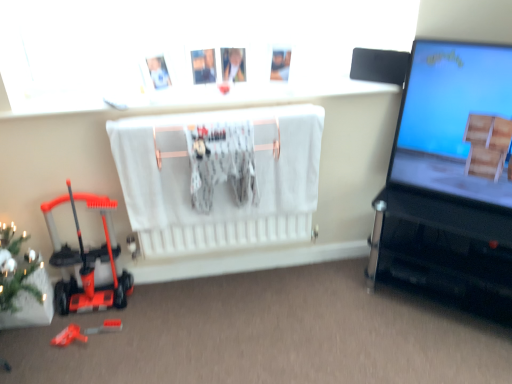
What do you see at coordinates (451, 117) in the screenshot? I see `matte blue screen at right` at bounding box center [451, 117].

Measure the distance between point (110,329) and camera.

Point (110,329) and camera are 6.45 feet apart.

This screenshot has height=384, width=512. What are the coordinates of `orange plastic toy at lower left, positioned as the 3th toy in bottom-to-top order` in the screenshot? It's located at (88, 261).

Considering the sizes of objects orange plastic toy at lower left, positioned as the 3th toy in bottom-to-top order, and matte blue screen at right in the image provided, who is taller, orange plastic toy at lower left, positioned as the 3th toy in bottom-to-top order, or matte blue screen at right?

Standing taller between the two is matte blue screen at right.

There is a matte blue screen at right. Identify the location of the 1st toy below it (from a real-world perspective). (88, 261).

Is orange plastic toy at lower left, positioned as the 3th toy in bottom-to-top order, smaller than matte blue screen at right?

Indeed, orange plastic toy at lower left, positioned as the 3th toy in bottom-to-top order, has a smaller size compared to matte blue screen at right.

In the scene shown: From a real-world perspective, who is located higher, orange plastic toy at lower left, positioned as the 3th toy in bottom-to-top order, or matte blue screen at right?

matte blue screen at right is physically above.

From the picture: From a real-world perspective, is rubberized orange toy at lower left, which is counted as the 2th toy, starting from the top, physically located above or below orange plastic toy at lower left, positioned as the 3th toy in bottom-to-top order?

In terms of real-world spatial position, rubberized orange toy at lower left, which is counted as the 2th toy, starting from the top, is below orange plastic toy at lower left, positioned as the 3th toy in bottom-to-top order.

Is rubberized orange toy at lower left, which is counted as the second toy, starting from the bottom, looking in the opposite direction of orange plastic toy at lower left, positioned as the 3th toy in bottom-to-top order?

Absolutely, rubberized orange toy at lower left, which is counted as the second toy, starting from the bottom, is directed away from orange plastic toy at lower left, positioned as the 3th toy in bottom-to-top order.

Considering the relative sizes of rubberized orange toy at lower left, which is counted as the second toy, starting from the bottom, and orange plastic toy at lower left, the 1th toy when ordered from top to bottom, in the image provided, is rubberized orange toy at lower left, which is counted as the second toy, starting from the bottom, taller than orange plastic toy at lower left, the 1th toy when ordered from top to bottom,?

No.

What's the angular difference between rubberized orange toy at lower left, which is counted as the second toy, starting from the bottom, and orange plastic toy at lower left, positioned as the 3th toy in bottom-to-top order,'s facing directions?

They differ by 7.6e-05 degrees in their facing directions.

From a real-world perspective, does green matte christmas tree at lower left stand above black glossy tv stand at right?

No, from a real-world perspective, green matte christmas tree at lower left is not on top of black glossy tv stand at right.

Considering the positions of objects green matte christmas tree at lower left and black glossy tv stand at right in the image provided, who is more to the right, green matte christmas tree at lower left or black glossy tv stand at right?

From the viewer's perspective, black glossy tv stand at right appears more on the right side.

In terms of height, does green matte christmas tree at lower left look taller or shorter compared to black glossy tv stand at right?

green matte christmas tree at lower left is shorter than black glossy tv stand at right.

Is point (15, 285) closer or farther from the camera than point (443, 219)?

Point (15, 285).

What's the angular difference between black glossy tv stand at right and rubberized orange toy at lower left, the first toy from the bottom,'s facing directions?

The angle between the facing direction of black glossy tv stand at right and the facing direction of rubberized orange toy at lower left, the first toy from the bottom, is 42.8 degrees.

Between black glossy tv stand at right and rubberized orange toy at lower left, the first toy from the bottom, which one has less height?

rubberized orange toy at lower left, the first toy from the bottom.

Between black glossy tv stand at right and rubberized orange toy at lower left, arranged as the 3th toy when viewed from the top, which one has larger width?

black glossy tv stand at right.

From the image's perspective, is black glossy tv stand at right below rubberized orange toy at lower left, which is counted as the 2th toy, starting from the top?

No, from the image's perspective, black glossy tv stand at right is not below rubberized orange toy at lower left, which is counted as the 2th toy, starting from the top.

Considering the relative sizes of black glossy tv stand at right and rubberized orange toy at lower left, which is counted as the 2th toy, starting from the top, in the image provided, is black glossy tv stand at right shorter than rubberized orange toy at lower left, which is counted as the 2th toy, starting from the top,?

No.

Looking at their sizes, would you say black glossy tv stand at right is wider or thinner than rubberized orange toy at lower left, which is counted as the 2th toy, starting from the top?

In the image, black glossy tv stand at right appears to be wider than rubberized orange toy at lower left, which is counted as the 2th toy, starting from the top.

Would you say black glossy tv stand at right contains rubberized orange toy at lower left, which is counted as the second toy, starting from the bottom?

Actually, rubberized orange toy at lower left, which is counted as the second toy, starting from the bottom, is outside black glossy tv stand at right.

How many degrees apart are the facing directions of orange plastic toy at lower left, the 1th toy when ordered from top to bottom, and black glossy tv stand at right?

The angle between the facing direction of orange plastic toy at lower left, the 1th toy when ordered from top to bottom, and the facing direction of black glossy tv stand at right is 42.8 degrees.

Which object is thinner, orange plastic toy at lower left, the 1th toy when ordered from top to bottom, or black glossy tv stand at right?

orange plastic toy at lower left, the 1th toy when ordered from top to bottom, is thinner.

Is orange plastic toy at lower left, the 1th toy when ordered from top to bottom, facing away from black glossy tv stand at right?

No, black glossy tv stand at right is not at the back of orange plastic toy at lower left, the 1th toy when ordered from top to bottom.

Is orange plastic toy at lower left, positioned as the 3th toy in bottom-to-top order, bigger than black glossy tv stand at right?

Actually, orange plastic toy at lower left, positioned as the 3th toy in bottom-to-top order, might be smaller than black glossy tv stand at right.

Looking at this image, considering the sizes of objects rubberized orange toy at lower left, arranged as the 3th toy when viewed from the top, and black glossy tv stand at right in the image provided, who is wider, rubberized orange toy at lower left, arranged as the 3th toy when viewed from the top, or black glossy tv stand at right?

black glossy tv stand at right.

Is the position of rubberized orange toy at lower left, arranged as the 3th toy when viewed from the top, more distant than that of black glossy tv stand at right?

Yes, rubberized orange toy at lower left, arranged as the 3th toy when viewed from the top, is behind black glossy tv stand at right.

From a real-world perspective, is rubberized orange toy at lower left, arranged as the 3th toy when viewed from the top, below black glossy tv stand at right?

Yes, from a real-world perspective, rubberized orange toy at lower left, arranged as the 3th toy when viewed from the top, is under black glossy tv stand at right.

From the image's perspective, which is above, rubberized orange toy at lower left, arranged as the 3th toy when viewed from the top, or black glossy tv stand at right?

black glossy tv stand at right, from the image's perspective.

The image size is (512, 384). I want to click on toy that is the 1st object directly below the matte blue screen at right (from a real-world perspective), so click(88, 261).

Which toy is the 1st one when counting from the left side of the rubberized orange toy at lower left, which is counted as the 2th toy, starting from the top? Please provide its 2D coordinates.

[(88, 261)]

From the image, which object appears to be farther from rubberized orange toy at lower left, which is counted as the 2th toy, starting from the top, orange plastic toy at lower left, positioned as the 3th toy in bottom-to-top order, or green matte christmas tree at lower left?

The object further to rubberized orange toy at lower left, which is counted as the 2th toy, starting from the top, is green matte christmas tree at lower left.

From the image, which object appears to be farther from orange plastic toy at lower left, positioned as the 3th toy in bottom-to-top order, green matte christmas tree at lower left or rubberized orange toy at lower left, the first toy from the bottom?

rubberized orange toy at lower left, the first toy from the bottom, is positioned further to the anchor orange plastic toy at lower left, positioned as the 3th toy in bottom-to-top order.

When comparing their distances from rubberized orange toy at lower left, which is counted as the second toy, starting from the bottom, does green matte christmas tree at lower left or orange plastic toy at lower left, the 1th toy when ordered from top to bottom, seem further?

green matte christmas tree at lower left is positioned further to the anchor rubberized orange toy at lower left, which is counted as the second toy, starting from the bottom.

Consider the image. Estimate the real-world distances between objects in this image. Which object is closer to orange plastic toy at lower left, positioned as the 3th toy in bottom-to-top order, black glossy tv stand at right or matte blue screen at right?

Based on the image, black glossy tv stand at right appears to be nearer to orange plastic toy at lower left, positioned as the 3th toy in bottom-to-top order.

Based on their spatial positions, is rubberized orange toy at lower left, arranged as the 3th toy when viewed from the top, or rubberized orange toy at lower left, which is counted as the 2th toy, starting from the top, closer to orange plastic toy at lower left, positioned as the 3th toy in bottom-to-top order?

rubberized orange toy at lower left, which is counted as the 2th toy, starting from the top, is closer to orange plastic toy at lower left, positioned as the 3th toy in bottom-to-top order.

Looking at the image, which one is located closer to rubberized orange toy at lower left, which is counted as the 2th toy, starting from the top, green matte christmas tree at lower left or black glossy tv stand at right?

green matte christmas tree at lower left is closer to rubberized orange toy at lower left, which is counted as the 2th toy, starting from the top.

From the image, which object appears to be farther from orange plastic toy at lower left, the 1th toy when ordered from top to bottom, matte blue screen at right or green matte christmas tree at lower left?

Based on the image, matte blue screen at right appears to be further to orange plastic toy at lower left, the 1th toy when ordered from top to bottom.

Looking at the image, which one is located closer to green matte christmas tree at lower left, black glossy tv stand at right or rubberized orange toy at lower left, arranged as the 3th toy when viewed from the top?

Among the two, rubberized orange toy at lower left, arranged as the 3th toy when viewed from the top, is located nearer to green matte christmas tree at lower left.

Find the location of `computer screen between orange plastic toy at lower left, the 1th toy when ordered from top to bottom, and black glossy tv stand at right`. computer screen between orange plastic toy at lower left, the 1th toy when ordered from top to bottom, and black glossy tv stand at right is located at coordinates (451, 117).

Find the location of a particular element. computer screen between rubberized orange toy at lower left, arranged as the 3th toy when viewed from the top, and black glossy tv stand at right from left to right is located at coordinates (451, 117).

At what (x,y) coordinates should I click in order to perform the action: click on computer screen situated between rubberized orange toy at lower left, which is counted as the 2th toy, starting from the top, and black glossy tv stand at right from left to right. Please return your answer as a coordinate pair (x, y). This screenshot has height=384, width=512. Looking at the image, I should click on pyautogui.click(x=451, y=117).

The height and width of the screenshot is (384, 512). I want to click on toy between orange plastic toy at lower left, the 1th toy when ordered from top to bottom, and black glossy tv stand at right from left to right, so click(x=106, y=327).